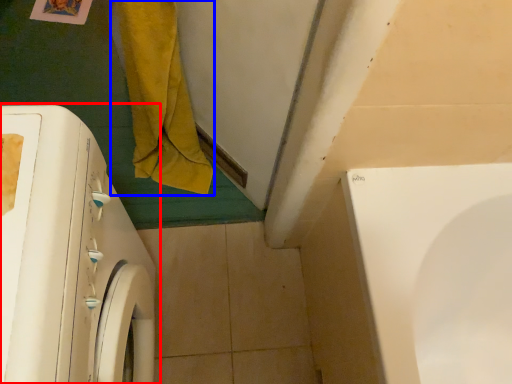
Question: Which object appears farthest to the camera in this image, washing machine (highlighted by a red box) or bath towel (highlighted by a blue box)?

Choices:
 (A) washing machine
 (B) bath towel

Answer: (B)